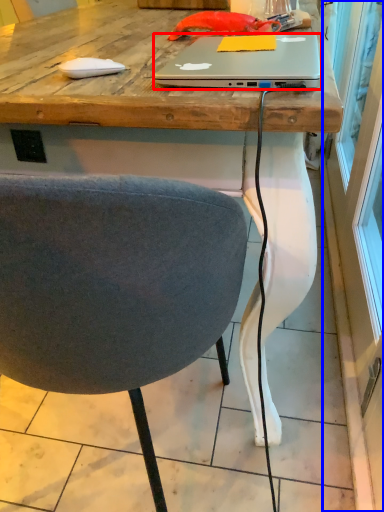
Question: Among these objects, which one is farthest to the camera, laptop (highlighted by a red box) or screen door (highlighted by a blue box)?

Choices:
 (A) laptop
 (B) screen door

Answer: (A)